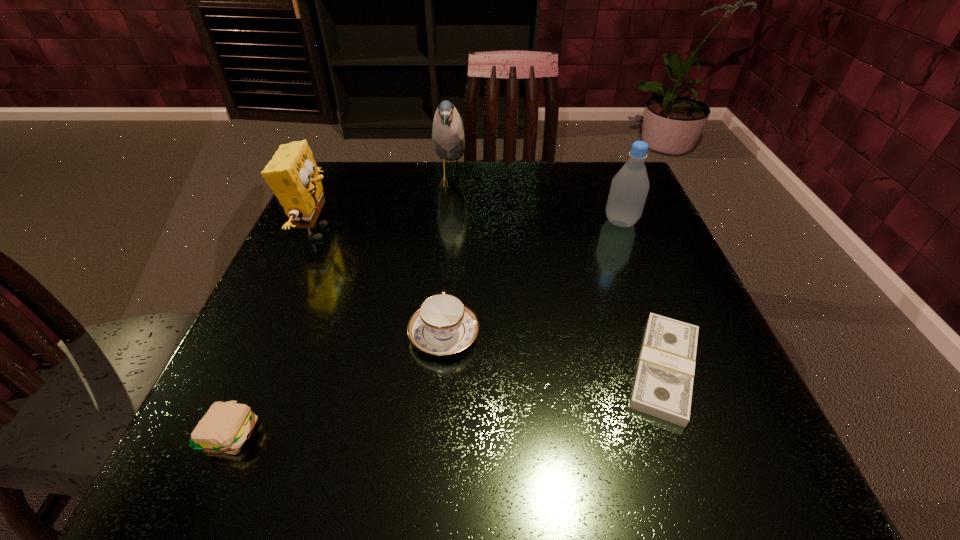
Where is `free space in the image that satisfies the following two spatial constraints: 1. on the face of the shortest object; 2. on the right side of the sponge`? free space in the image that satisfies the following two spatial constraints: 1. on the face of the shortest object; 2. on the right side of the sponge is located at coordinates (256, 369).